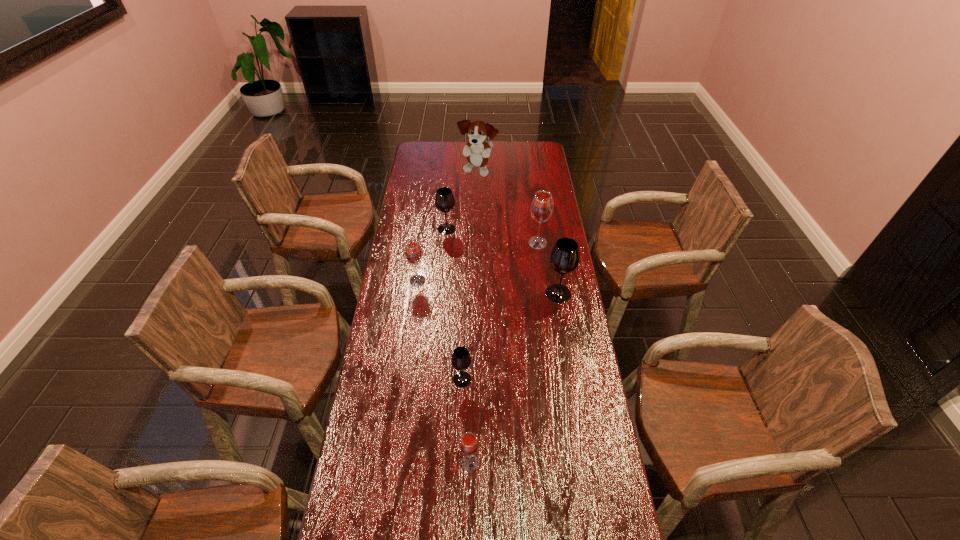
You are a GUI agent. You are given a task and a screenshot of the screen. Output one action in this format:
    pyautogui.click(x=<x>, y=<y>)
    Task: Click on the nearest wineglass
    This screenshot has height=540, width=960.
    Given the screenshot: What is the action you would take?
    pyautogui.click(x=469, y=445)

At what (x,y) coordinates should I click in order to perform the action: click on the nearest object. Please return your answer as a coordinate pair (x, y). Looking at the image, I should click on (469, 445).

Where is `the second nearest object`? Image resolution: width=960 pixels, height=540 pixels. the second nearest object is located at coordinates (461, 360).

This screenshot has height=540, width=960. What are the coordinates of `the second nearest wineglass` in the screenshot? It's located at (461, 360).

Locate an element on the screen. The image size is (960, 540). vacant space positioned 0.270m on the face of the farthest object is located at coordinates (477, 215).

At what (x,y) coordinates should I click in order to perform the action: click on vacant space situated on the back of the rightmost red wineglass. Please return your answer as a coordinate pair (x, y). The width and height of the screenshot is (960, 540). Looking at the image, I should click on (532, 202).

This screenshot has width=960, height=540. Find the location of `vacant point located on the left of the biggest gray wineglass`. vacant point located on the left of the biggest gray wineglass is located at coordinates (470, 294).

Locate an element on the screen. vacant region located on the right of the leftmost object is located at coordinates (454, 281).

Identify the location of vacant space located on the back of the farthest wineglass. The width and height of the screenshot is (960, 540). (449, 192).

The width and height of the screenshot is (960, 540). Identify the location of vacant space located on the back of the smallest red wineglass. (471, 396).